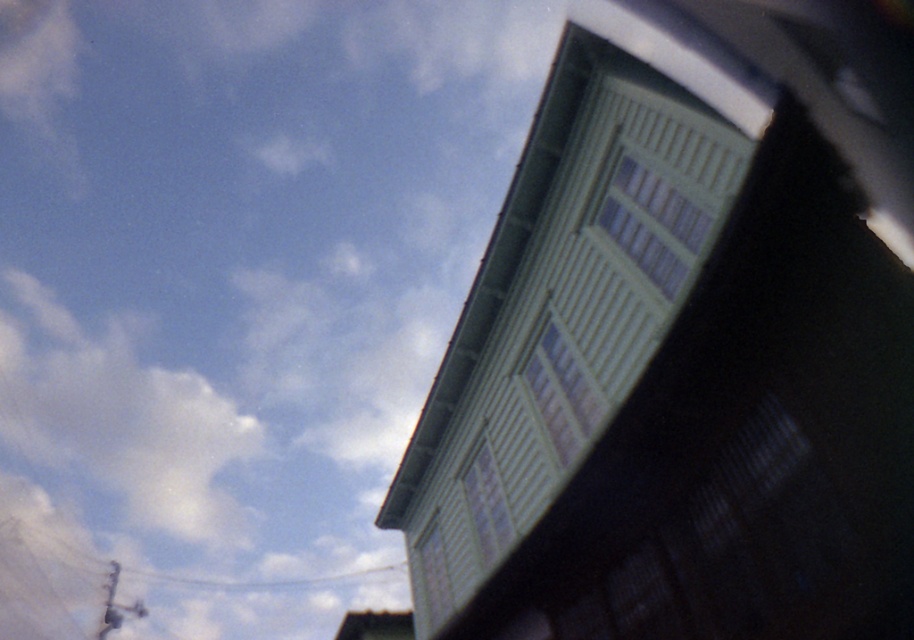
Question: Can you confirm if green matte window at upper right is positioned below white fluffy cloud at upper left?

Choices:
 (A) no
 (B) yes

Answer: (A)

Question: Which object is farther from the camera taking this photo?

Choices:
 (A) metallic wire at upper center
 (B) green matte window at upper right
 (C) white fluffy cloud at upper left

Answer: (A)

Question: Is green matte window at upper right below white fluffy cloud at upper left?

Choices:
 (A) no
 (B) yes

Answer: (A)

Question: Among these points, which one is nearest to the camera?

Choices:
 (A) (149, 570)
 (B) (675, 202)

Answer: (B)

Question: Estimate the real-world distances between objects in this image. Which object is closer to the green matte window at upper right?

Choices:
 (A) white fluffy cloud at upper left
 (B) metallic wire at upper center

Answer: (B)

Question: Is the position of green matte window at upper right more distant than that of metallic wire at upper center?

Choices:
 (A) yes
 (B) no

Answer: (B)